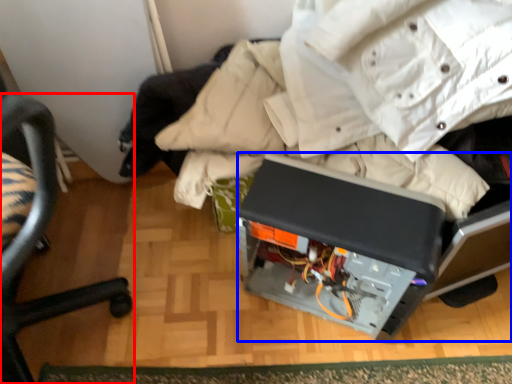
Question: Among these objects, which one is nearest to the camera, chair (highlighted by a red box) or wide (highlighted by a blue box)?

Choices:
 (A) chair
 (B) wide

Answer: (A)